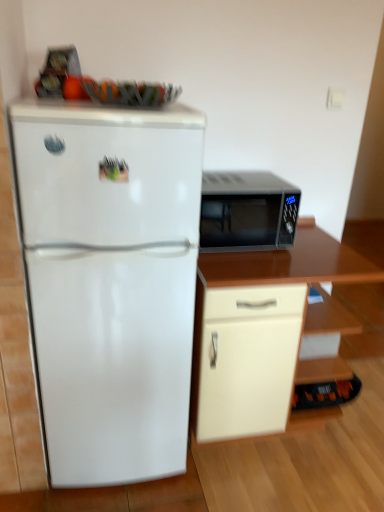
Find the location of a particular element. The height and width of the screenshot is (512, 384). vacant space that's between beige matte cabinet at lower right and white glossy refrigerator at left is located at coordinates (241, 463).